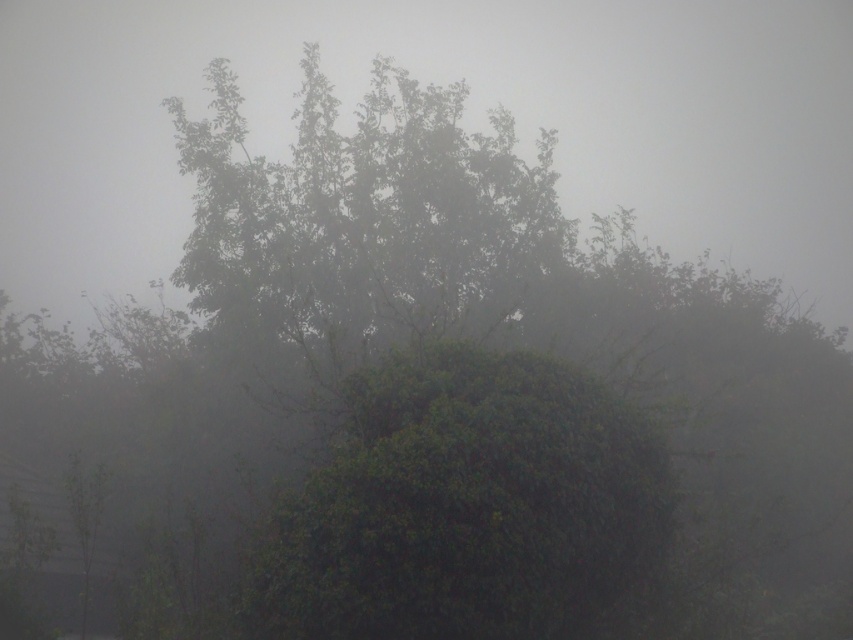
Between foggy translucent morning fog at upper center and green leafy bush at center, which one has less height?

Standing shorter between the two is green leafy bush at center.

Does foggy translucent morning fog at upper center have a greater height compared to green leafy bush at center?

Yes, foggy translucent morning fog at upper center is taller than green leafy bush at center.

Where is `foggy translucent morning fog at upper center`? The height and width of the screenshot is (640, 853). foggy translucent morning fog at upper center is located at coordinates (463, 120).

This screenshot has height=640, width=853. I want to click on foggy translucent morning fog at upper center, so click(463, 120).